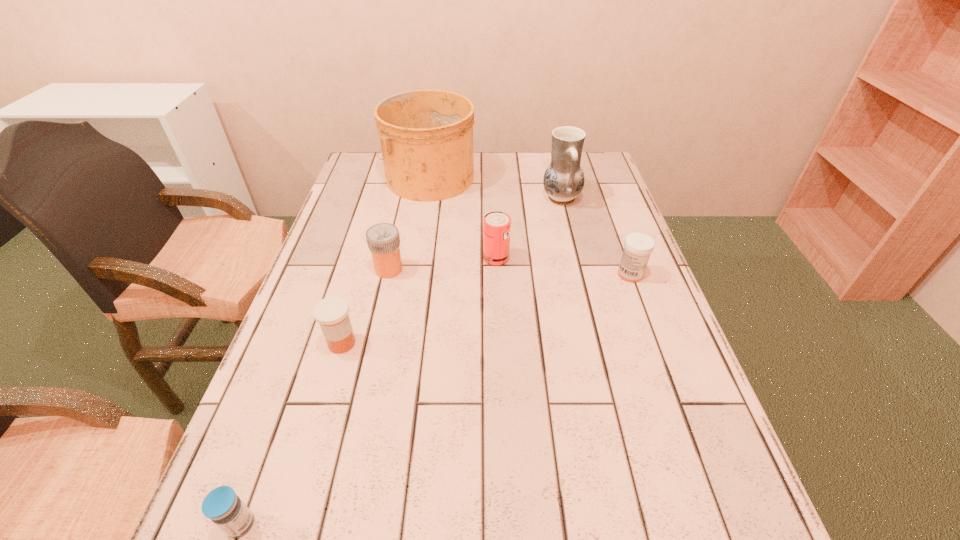
At what (x,y) coordinates should I click in order to perform the action: click on free space between the can and the leftmost medicine. Please return your answer as a coordinate pair (x, y). Looking at the image, I should click on (369, 391).

Choose which object is the second nearest neighbor to the pottery. Please provide its 2D coordinates. Your answer should be formatted as a tuple, i.e. [(x, y)], where the tuple contains the x and y coordinates of a point satisfying the conditions above.

[(426, 136)]

The image size is (960, 540). I want to click on object that stands as the sixth closest to the nearest medicine, so click(563, 181).

Where is `medicine that is the second closest one to the sixth farthest object`? The height and width of the screenshot is (540, 960). medicine that is the second closest one to the sixth farthest object is located at coordinates (221, 505).

Select which medicine is the fourth closest to the fifth object from left to right. Please provide its 2D coordinates. Your answer should be formatted as a tuple, i.e. [(x, y)], where the tuple contains the x and y coordinates of a point satisfying the conditions above.

[(221, 505)]

The width and height of the screenshot is (960, 540). Identify the location of vacant space that satisfies the following two spatial constraints: 1. on the front side of the bucket; 2. on the label of the second nearest object. (402, 343).

This screenshot has height=540, width=960. In order to click on vacant area that satisfies the following two spatial constraints: 1. on the back side of the nearest object; 2. on the right side of the rightmost object in this screenshot , I will do `click(331, 274)`.

The image size is (960, 540). Find the location of `vacant space that satisfies the following two spatial constraints: 1. on the back side of the leftmost medicine; 2. on the left side of the rightmost object`. vacant space that satisfies the following two spatial constraints: 1. on the back side of the leftmost medicine; 2. on the left side of the rightmost object is located at coordinates (331, 274).

Identify the location of vacant region that satisfies the following two spatial constraints: 1. on the front side of the third object from right to left; 2. on the right side of the bucket. Image resolution: width=960 pixels, height=540 pixels. (416, 258).

Locate an element on the screen. free space that satisfies the following two spatial constraints: 1. on the front side of the second object from right to left; 2. on the label of the third farthest medicine is located at coordinates (596, 343).